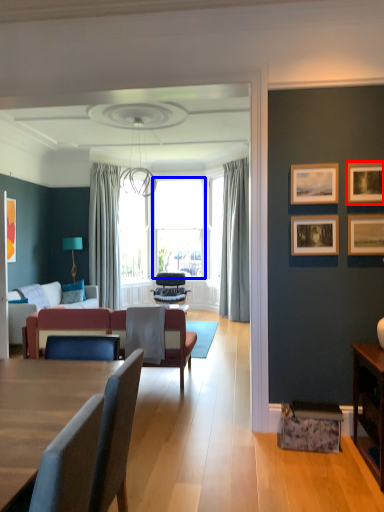
Question: Which point is closer to the camera, picture frame (highlighted by a red box) or window screen (highlighted by a blue box)?

Choices:
 (A) picture frame
 (B) window screen

Answer: (A)